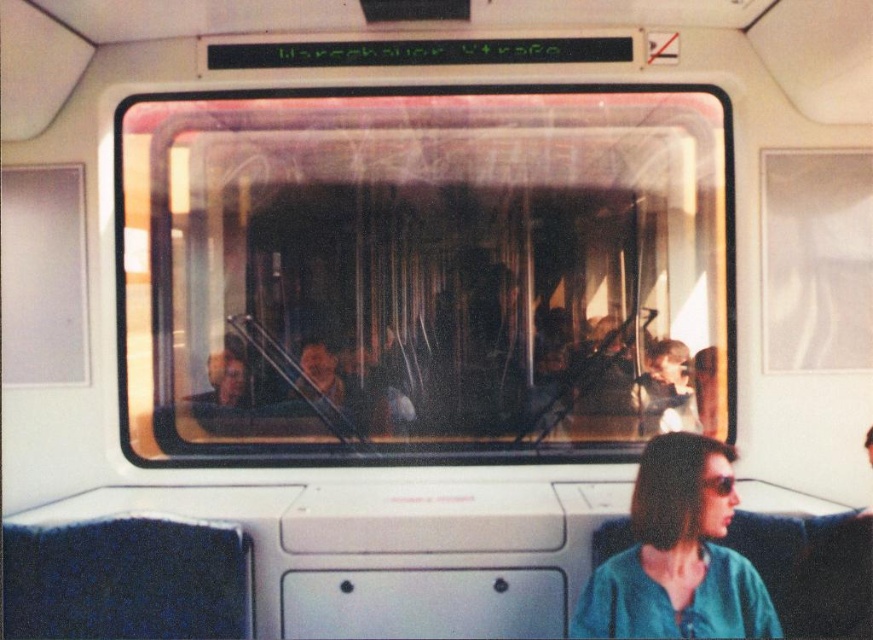
Question: Which of the following is the closest to the observer?

Choices:
 (A) transparent glass train window at center
 (B) teal fabric shirt at lower right

Answer: (B)

Question: In this image, where is transparent glass train window at center located relative to teal fabric shirt at lower right?

Choices:
 (A) left
 (B) right

Answer: (A)

Question: Does transparent glass train window at center have a lesser width compared to teal fabric shirt at lower right?

Choices:
 (A) no
 (B) yes

Answer: (A)

Question: Does transparent glass train window at center have a greater width compared to teal fabric shirt at lower right?

Choices:
 (A) yes
 (B) no

Answer: (A)

Question: Which point appears farthest from the camera in this image?

Choices:
 (A) (692, 280)
 (B) (733, 600)

Answer: (A)